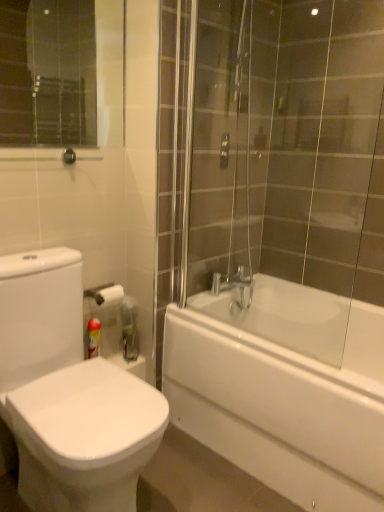
Where is `white glossy bathtub at right`? white glossy bathtub at right is located at coordinates (284, 389).

This screenshot has width=384, height=512. Describe the element at coordinates (85, 437) in the screenshot. I see `white glossy bidet at lower left` at that location.

Find the location of `red plastic can at lower left`. red plastic can at lower left is located at coordinates (93, 337).

Image resolution: width=384 pixels, height=512 pixels. Identify the location of white glossy bathtub at right. (284, 389).

Is white glossy bathtub at right bigger or smaller than red plastic can at lower left?

Clearly, white glossy bathtub at right is larger in size than red plastic can at lower left.

From the image's perspective, is white glossy bathtub at right above red plastic can at lower left?

No.

Is white glossy bathtub at right not near red plastic can at lower left?

That's not correct — white glossy bathtub at right is a little close to red plastic can at lower left.

Is white glossy bathtub at right not inside red plastic can at lower left?

Indeed, white glossy bathtub at right is completely outside red plastic can at lower left.

Can you see red plastic can at lower left touching white glossy bidet at lower left?

No, red plastic can at lower left is not in contact with white glossy bidet at lower left.

From the image's perspective, is red plastic can at lower left positioned above or below white glossy bidet at lower left?

From the image's perspective, red plastic can at lower left appears above white glossy bidet at lower left.

Is red plastic can at lower left inside the boundaries of white glossy bidet at lower left, or outside?

red plastic can at lower left is not enclosed by white glossy bidet at lower left.

Between red plastic can at lower left and white glossy bidet at lower left, which one has larger width?

white glossy bidet at lower left.

How distant is white glossy bidet at lower left from red plastic can at lower left?

white glossy bidet at lower left and red plastic can at lower left are 21.02 inches apart.

From the image's perspective, which one is positioned lower, white glossy bidet at lower left or red plastic can at lower left?

white glossy bidet at lower left is shown below in the image.

From a real-world perspective, is white glossy bidet at lower left physically above red plastic can at lower left?

Indeed, from a real-world perspective, white glossy bidet at lower left stands above red plastic can at lower left.

Based on their positions, is white glossy bidet at lower left located to the left or right of red plastic can at lower left?

white glossy bidet at lower left is to the right of red plastic can at lower left.

Which object is closer to the camera, white glossy bathtub at right or white glossy bidet at lower left?

white glossy bidet at lower left is more forward.

Does white glossy bathtub at right turn towards white glossy bidet at lower left?

Yes.

Find the location of a particular element. Image resolution: width=384 pixels, height=512 pixels. bathtub that is behind the white glossy bidet at lower left is located at coordinates (284, 389).

Considering the relative positions of red plastic can at lower left and white glossy bathtub at right in the image provided, is red plastic can at lower left to the left of white glossy bathtub at right from the viewer's perspective?

Yes, red plastic can at lower left is to the left of white glossy bathtub at right.

Is red plastic can at lower left shorter than white glossy bathtub at right?

Yes.

Is red plastic can at lower left smaller than white glossy bathtub at right?

Correct, red plastic can at lower left occupies less space than white glossy bathtub at right.

Is red plastic can at lower left outside of white glossy bathtub at right?

Yes, red plastic can at lower left is located beyond the bounds of white glossy bathtub at right.

Is white glossy bidet at lower left to the right of white glossy bathtub at right from the viewer's perspective?

Incorrect, white glossy bidet at lower left is not on the right side of white glossy bathtub at right.

From the image's perspective, does white glossy bidet at lower left appear higher than white glossy bathtub at right?

Indeed, from the image's perspective, white glossy bidet at lower left is shown above white glossy bathtub at right.

How different are the orientations of white glossy bidet at lower left and white glossy bathtub at right in degrees?

The angle between the facing direction of white glossy bidet at lower left and the facing direction of white glossy bathtub at right is 90.1 degrees.

Is white glossy bidet at lower left looking in the opposite direction of white glossy bathtub at right?

No, white glossy bidet at lower left is not facing the opposite direction of white glossy bathtub at right.

This screenshot has width=384, height=512. I want to click on toiletry behind the white glossy bathtub at right, so click(93, 337).

At what (x,y) coordinates should I click in order to perform the action: click on bidet below the red plastic can at lower left (from the image's perspective). Please return your answer as a coordinate pair (x, y). This screenshot has height=512, width=384. Looking at the image, I should click on pos(85,437).

Looking at the image, which one is located closer to white glossy bathtub at right, red plastic can at lower left or white glossy bidet at lower left?

The object closer to white glossy bathtub at right is white glossy bidet at lower left.

Considering their positions, is red plastic can at lower left positioned closer to white glossy bidet at lower left than white glossy bathtub at right?

Based on the image, red plastic can at lower left appears to be nearer to white glossy bidet at lower left.

Looking at the image, which one is located further to white glossy bidet at lower left, white glossy bathtub at right or red plastic can at lower left?

white glossy bathtub at right is further to white glossy bidet at lower left.

Considering their positions, is white glossy bidet at lower left positioned further to red plastic can at lower left than white glossy bathtub at right?

white glossy bathtub at right is further to red plastic can at lower left.

From the image, which object appears to be farther from white glossy bathtub at right, white glossy bidet at lower left or red plastic can at lower left?

The object further to white glossy bathtub at right is red plastic can at lower left.

Consider the image. Which object lies nearer to the anchor point red plastic can at lower left, white glossy bathtub at right or white glossy bidet at lower left?

The object closer to red plastic can at lower left is white glossy bidet at lower left.

You are a GUI agent. You are given a task and a screenshot of the screen. Output one action in this format:
    pyautogui.click(x=<x>, y=<y>)
    Task: Click on the bidet between red plastic can at lower left and white glossy bathtub at right
    
    Given the screenshot: What is the action you would take?
    pyautogui.click(x=85, y=437)